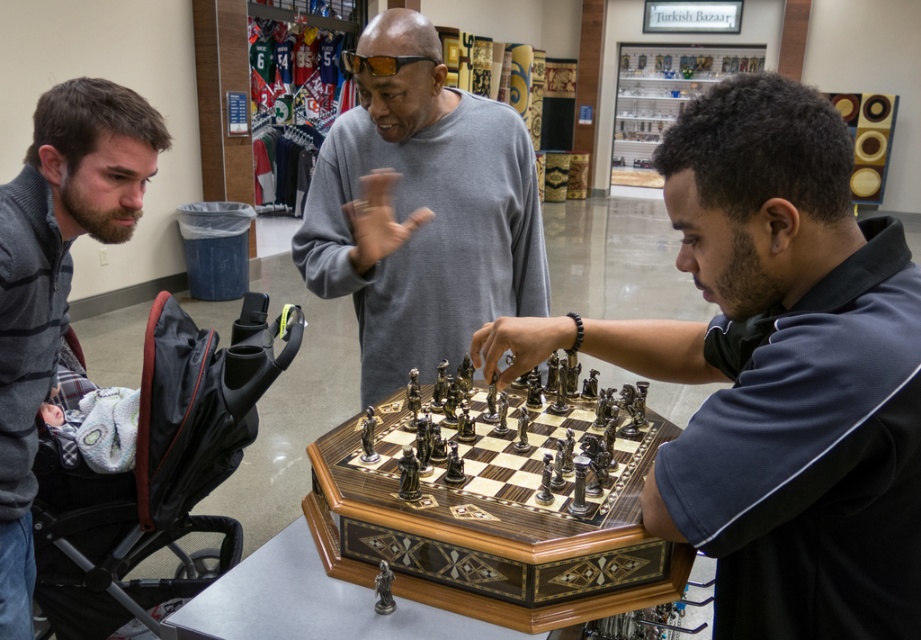
Question: From the image, what is the correct spatial relationship of black fabric baby carriage at left in relation to gray sweater at left?

Choices:
 (A) above
 (B) below

Answer: (B)

Question: Which object is farther from the camera taking this photo?

Choices:
 (A) wooden chess set at center
 (B) gray sweater at center

Answer: (B)

Question: Where is metallic chess pieces at center located in relation to gray sweater at center in the image?

Choices:
 (A) left
 (B) right

Answer: (B)

Question: Can you confirm if metallic chess pieces at center is positioned to the left of gray sweater at center?

Choices:
 (A) yes
 (B) no

Answer: (B)

Question: Among these points, which one is farthest from the camera?

Choices:
 (A) (470, 552)
 (B) (106, 152)
 (C) (274, 333)

Answer: (C)

Question: Which of the following is the closest to the observer?

Choices:
 (A) gray sweater at left
 (B) metallic chess pieces at center

Answer: (B)